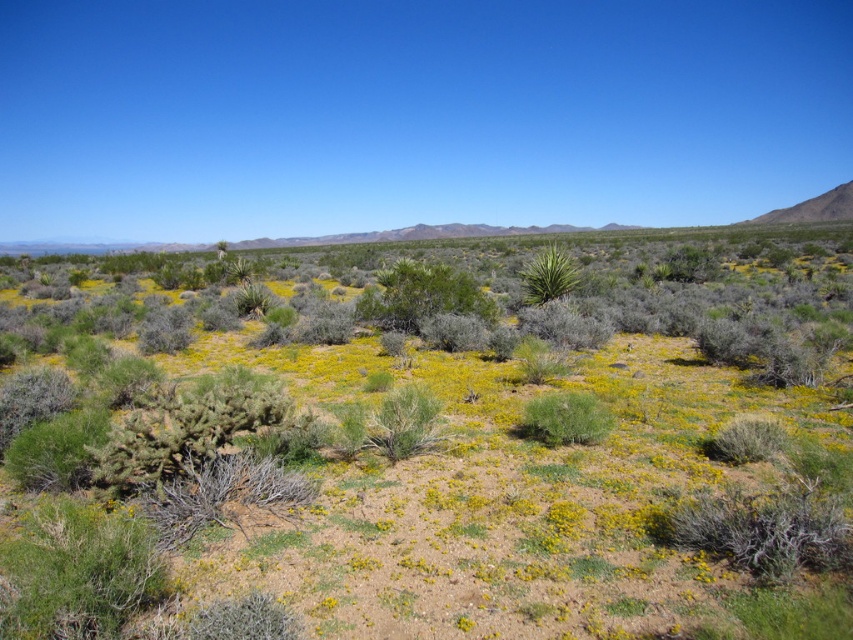
You are a hiker who needs to determine which plant is taller between the green shrubs at center and the green spiky bush at center. Based on the scene, which one is taller?

The green spiky bush at center is taller than the green shrubs at center.

You are standing at the point marked by the coordinates point (447, 461) in the desert scene. Looking around, you see green shrubs at center. Can you tell whether you are standing on the green shrubs at center or somewhere else?

The point (447, 461) is on green shrubs at center, so yes, you are standing on the green shrubs at center.

You are standing at the center of the desert and see a point marked at coordinates (421, 296). Which object is this point located on?

The point at (421, 296) is located on the green leafy bush at center.